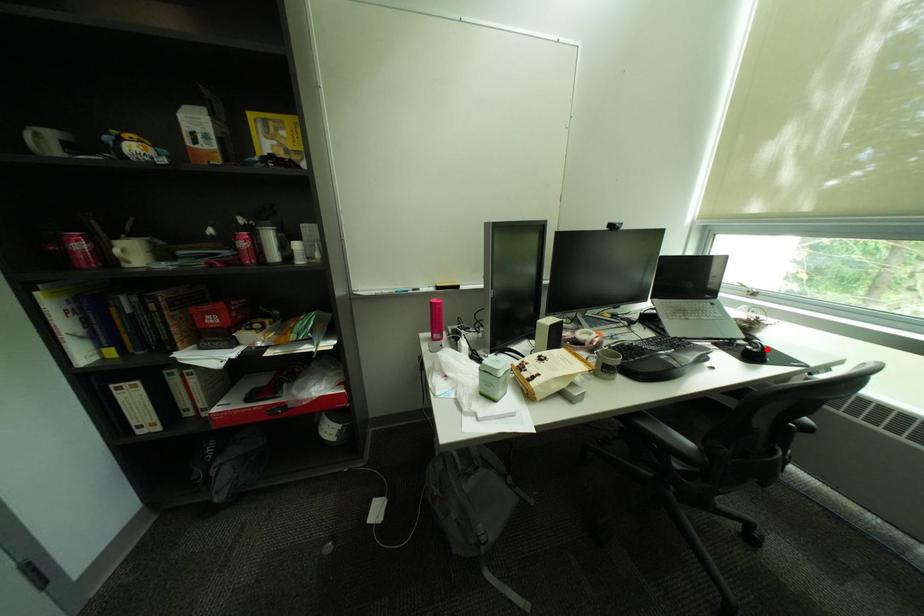
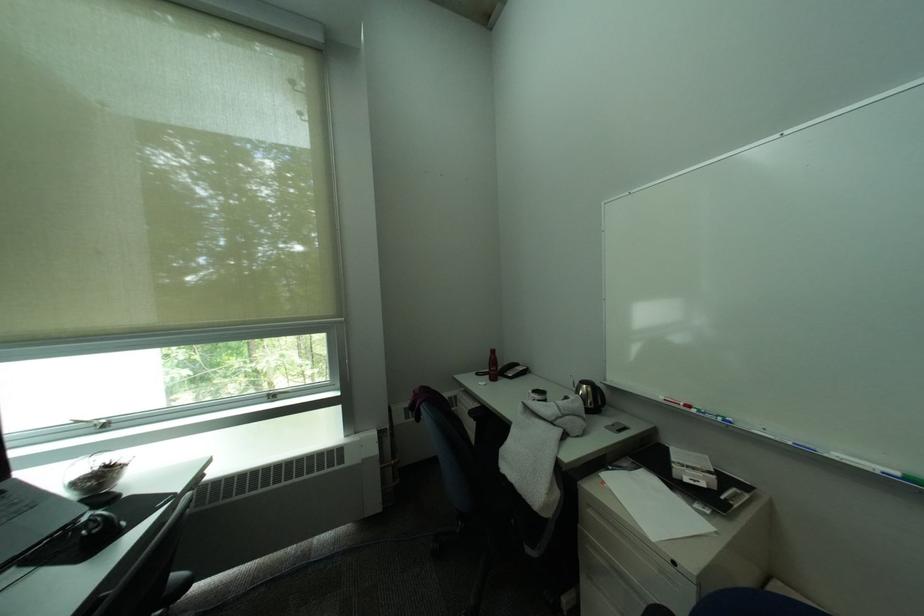
Locate, in the second image, the point that corresponds to the highlighted location in the first image.

(106, 528)